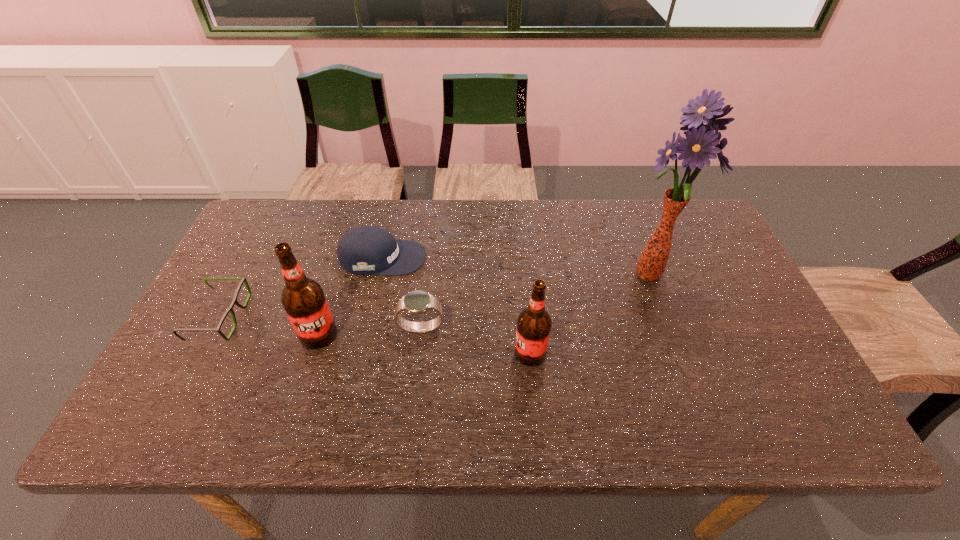
Identify which object is the fifth closest to the second tallest object. Please provide its 2D coordinates. Your answer should be formatted as a tuple, i.e. [(x, y)], where the tuple contains the x and y coordinates of a point satisfying the conditions above.

[(700, 117)]

Find the location of a particular element. This screenshot has height=540, width=960. object that is the second nearest to the shortest object is located at coordinates (364, 250).

At what (x,y) coordinates should I click in order to perform the action: click on vacant space that satisfies the following two spatial constraints: 1. on the back side of the watch; 2. on the front-facing side of the baseball cap. Please return your answer as a coordinate pair (x, y). Looking at the image, I should click on (429, 258).

Find the location of a particular element. The height and width of the screenshot is (540, 960). vacant space that satisfies the following two spatial constraints: 1. on the front-facing side of the watch; 2. on the left side of the baseball cap is located at coordinates (367, 328).

Identify the location of free point that satisfies the following two spatial constraints: 1. on the lens of the spectacles; 2. on the left side of the watch. Image resolution: width=960 pixels, height=540 pixels. click(214, 328).

The width and height of the screenshot is (960, 540). I want to click on vacant region that satisfies the following two spatial constraints: 1. on the lens of the shorter root beer; 2. on the left side of the spectacles, so click(201, 354).

Locate an element on the screen. Image resolution: width=960 pixels, height=540 pixels. free region that satisfies the following two spatial constraints: 1. on the lens of the spectacles; 2. on the right side of the watch is located at coordinates (214, 328).

The height and width of the screenshot is (540, 960). I want to click on vacant space that satisfies the following two spatial constraints: 1. on the front-facing side of the tallest object; 2. on the right side of the baseball cap, so click(x=378, y=275).

The height and width of the screenshot is (540, 960). Identify the location of free spot that satisfies the following two spatial constraints: 1. on the lens of the fifth object from left to right; 2. on the left side of the shortest object. (201, 354).

I want to click on blank area in the image that satisfies the following two spatial constraints: 1. on the front-facing side of the baseball cap; 2. on the back side of the rightmost object, so click(x=378, y=275).